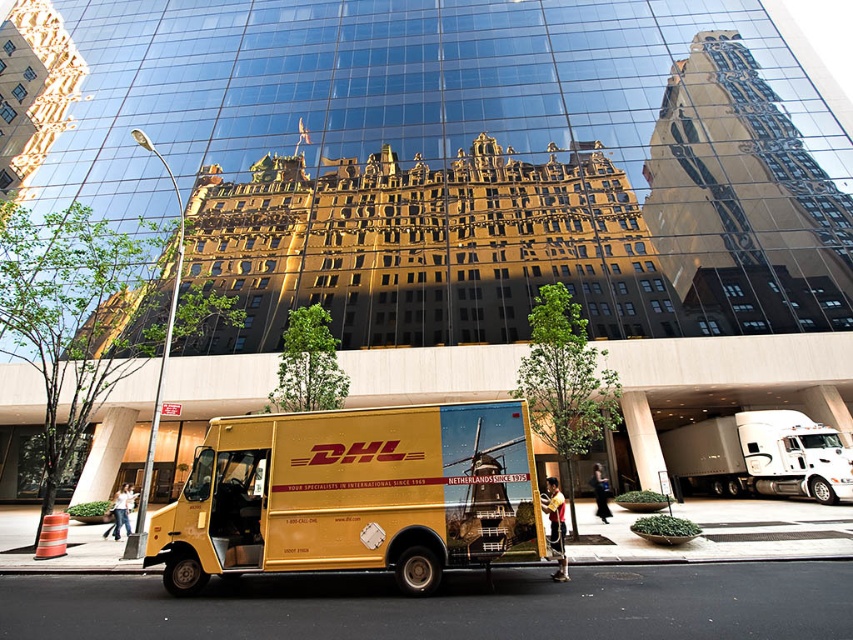
Question: Which point is closer to the camera?

Choices:
 (A) metallic yellow delivery truck at center
 (B) white glossy semi-truck at lower right

Answer: (A)

Question: Is metallic yellow delivery truck at center to the left of white glossy semi-truck at lower right from the viewer's perspective?

Choices:
 (A) no
 (B) yes

Answer: (B)

Question: Is metallic yellow delivery truck at center bigger than white glossy semi-truck at lower right?

Choices:
 (A) no
 (B) yes

Answer: (B)

Question: Considering the relative positions of metallic yellow delivery truck at center and white glossy semi-truck at lower right in the image provided, where is metallic yellow delivery truck at center located with respect to white glossy semi-truck at lower right?

Choices:
 (A) left
 (B) right

Answer: (A)

Question: Which object is farther from the camera taking this photo?

Choices:
 (A) white glossy semi-truck at lower right
 (B) metallic yellow delivery truck at center

Answer: (A)